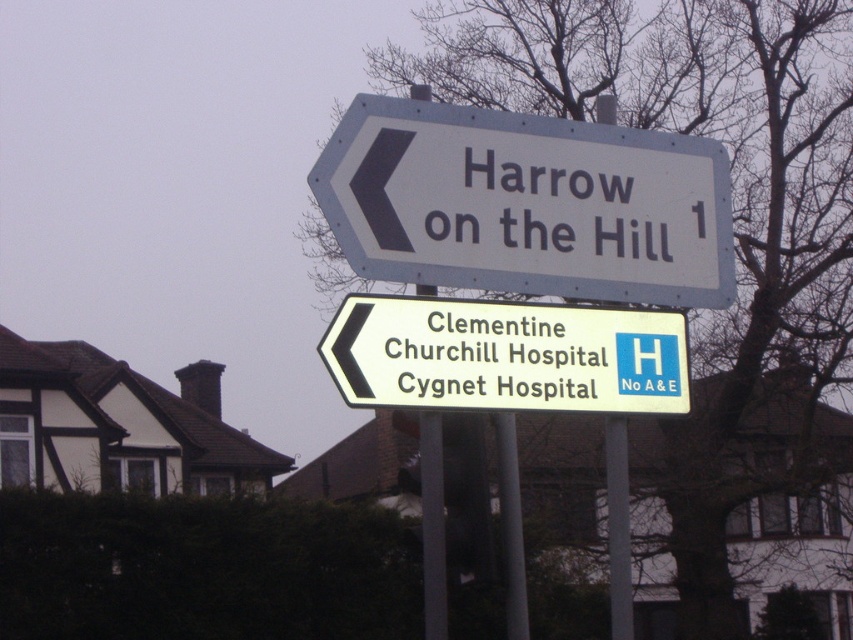
You are a driver approaching the signpost and need to read both the white plastic sign at upper center and the white plastic sign at lower center. Which sign will appear closer to you as you look at the signpost?

The white plastic sign at upper center will appear closer to you because it is further to the viewer than the white plastic sign at lower center.